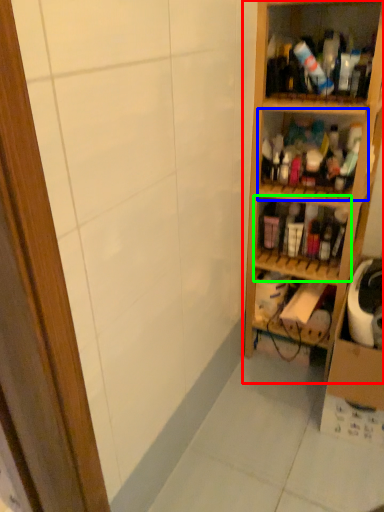
Question: Estimate the real-world distances between objects in this image. Which object is closer to shelf (highlighted by a red box), shelf (highlighted by a blue box) or shelf (highlighted by a green box)?

Choices:
 (A) shelf
 (B) shelf

Answer: (A)